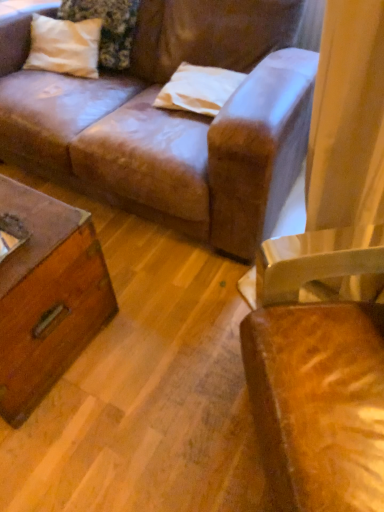
Question: Is white matte pillow at upper center, the second pillow in the left-to-right sequence, facing towards leather chair at right?

Choices:
 (A) no
 (B) yes

Answer: (A)

Question: Is leather chair at right at the back of white matte pillow at upper center, placed as the 2th pillow when sorted from top to bottom?

Choices:
 (A) no
 (B) yes

Answer: (A)

Question: From the image's perspective, is white matte pillow at upper center, the second pillow in the left-to-right sequence, located above leather chair at right?

Choices:
 (A) yes
 (B) no

Answer: (A)

Question: Is white matte pillow at upper center, placed as the first pillow when sorted from right to left, bigger than leather chair at right?

Choices:
 (A) no
 (B) yes

Answer: (A)

Question: From a real-world perspective, is white matte pillow at upper center, placed as the first pillow when sorted from right to left, beneath leather chair at right?

Choices:
 (A) no
 (B) yes

Answer: (A)

Question: Relative to white cotton pillow at upper left, acting as the first pillow starting from the left, is leather chair at right in front or behind?

Choices:
 (A) front
 (B) behind

Answer: (A)

Question: Does point (382, 268) appear closer or farther from the camera than point (124, 23)?

Choices:
 (A) farther
 (B) closer

Answer: (B)

Question: Is leather chair at right inside or outside of white cotton pillow at upper left, which is the second pillow in right-to-left order?

Choices:
 (A) outside
 (B) inside

Answer: (A)

Question: Based on their positions, is leather chair at right located to the left or right of white cotton pillow at upper left, which is the second pillow in right-to-left order?

Choices:
 (A) left
 (B) right

Answer: (B)

Question: Would you say white cotton pillow at upper left, acting as the first pillow starting from the left, is to the left or to the right of white matte pillow at upper center, placed as the 2th pillow when sorted from top to bottom, in the picture?

Choices:
 (A) right
 (B) left

Answer: (B)

Question: In the image, is white cotton pillow at upper left, acting as the first pillow starting from the left, positioned in front of or behind white matte pillow at upper center, the 1th pillow in the bottom-to-top sequence?

Choices:
 (A) behind
 (B) front

Answer: (A)

Question: Looking at their shapes, would you say white cotton pillow at upper left, acting as the first pillow starting from the left, is wider or thinner than white matte pillow at upper center, the 1th pillow in the bottom-to-top sequence?

Choices:
 (A) wide
 (B) thin

Answer: (A)

Question: From the image's perspective, is white cotton pillow at upper left, which is the 2th pillow in bottom-to-top order, located above or below white matte pillow at upper center, the second pillow in the left-to-right sequence?

Choices:
 (A) above
 (B) below

Answer: (A)

Question: Is point (324, 381) positioned closer to the camera than point (190, 73)?

Choices:
 (A) farther
 (B) closer

Answer: (B)

Question: Is leather chair at right inside the boundaries of white matte pillow at upper center, the second pillow in the left-to-right sequence, or outside?

Choices:
 (A) outside
 (B) inside

Answer: (A)